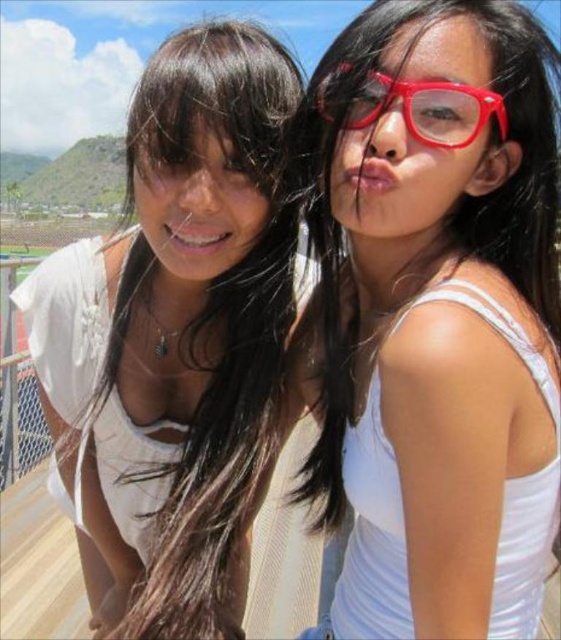
Is matte white tank top at center taller than shiny plastic glasses at upper right?

Yes, matte white tank top at center is taller than shiny plastic glasses at upper right.

In the scene shown: Between matte white tank top at center and shiny plastic glasses at upper right, which one has less height?

shiny plastic glasses at upper right

Is point (408, 554) positioned before point (466, 140)?

Yes, point (408, 554) is in front of point (466, 140).

Where is `matte white tank top at center`? matte white tank top at center is located at coordinates (430, 305).

Which is more to the right, white matte tank top at left or shiny plastic glasses at upper right?

From the viewer's perspective, shiny plastic glasses at upper right appears more on the right side.

Which is below, white matte tank top at left or shiny plastic glasses at upper right?

white matte tank top at left is lower down.

Is point (34, 333) closer to camera compared to point (410, 108)?

No, (34, 333) is behind (410, 108).

Identify the location of white matte tank top at left. The image size is (561, 640). (177, 340).

The height and width of the screenshot is (640, 561). What do you see at coordinates (430, 305) in the screenshot?
I see `matte white tank top at center` at bounding box center [430, 305].

Does point (512, 64) come in front of point (154, 396)?

Yes, it is in front of point (154, 396).

Where is `matte white tank top at center`? This screenshot has width=561, height=640. matte white tank top at center is located at coordinates (430, 305).